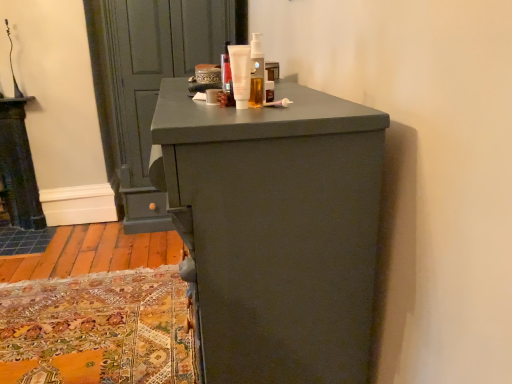
What are the coordinates of `vacant area that is in front of matte white cream at center, which is counted as the first toiletry, starting from the left` in the screenshot? It's located at (218, 115).